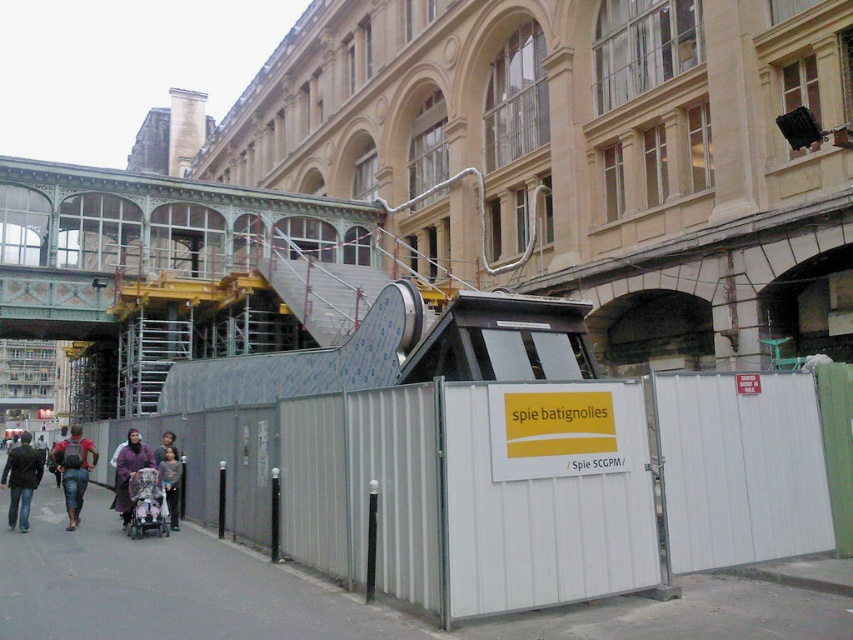
Question: Which of the following is the farthest from the observer?

Choices:
 (A) white metal fence at lower center
 (B) purple fabric coat at lower left
 (C) reddish-brown backpack at left

Answer: (C)

Question: Does green painted metal/wooden structure at upper center appear on the right side of purple fabric coat at lower left?

Choices:
 (A) yes
 (B) no

Answer: (B)

Question: Which object is positioned farthest from the light brown fabric baby stroller at lower center?

Choices:
 (A) silver metallic baby carriage at center
 (B) white metal fence at lower center
 (C) reddish-brown backpack at left
 (D) dark brown leather jacket at lower left

Answer: (D)

Question: Estimate the real-world distances between objects in this image. Which object is closer to the purple fabric coat at lower left?

Choices:
 (A) light brown fabric baby stroller at lower center
 (B) green painted metal/wooden structure at upper center

Answer: (A)

Question: Is white metal fence at lower center above light brown fabric baby stroller at lower center?

Choices:
 (A) no
 (B) yes

Answer: (B)

Question: Can you confirm if dark brown leather jacket at lower left is smaller than silver metallic baby carriage at center?

Choices:
 (A) no
 (B) yes

Answer: (A)